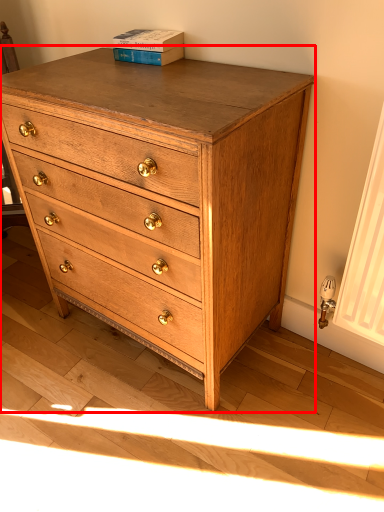
Question: From the image, what is the correct spatial relationship of chest of drawers (annotated by the red box) in relation to paperback book?

Choices:
 (A) right
 (B) left

Answer: (A)